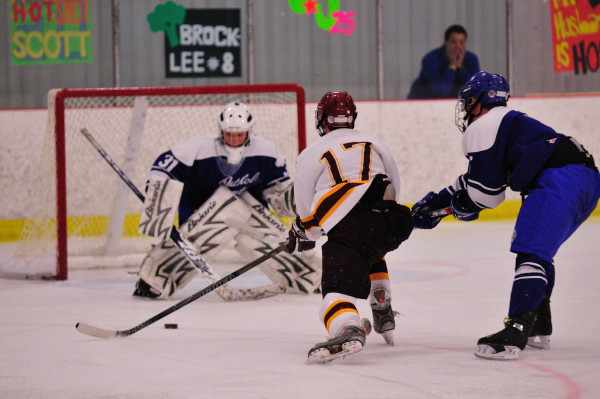
Identify the location of grey wall. The image size is (600, 399). (142, 65), (407, 42).